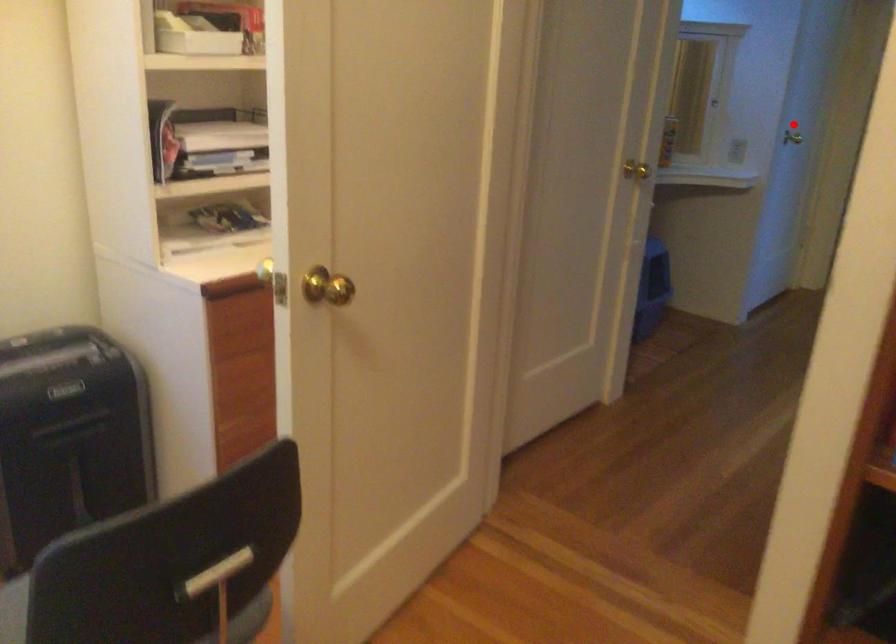
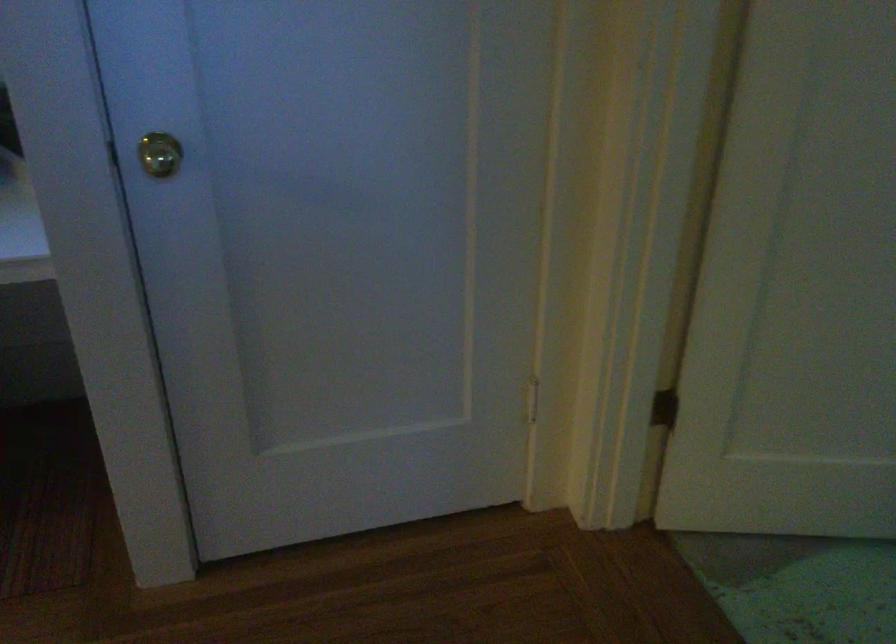
Question: A red point is marked in image1. In image2, is the corresponding 3D point closer to the camera or farther? Reply with the corresponding letter.

Choices:
 (A) The corresponding 3D point is closer.
 (B) The corresponding 3D point is farther.

Answer: (A)